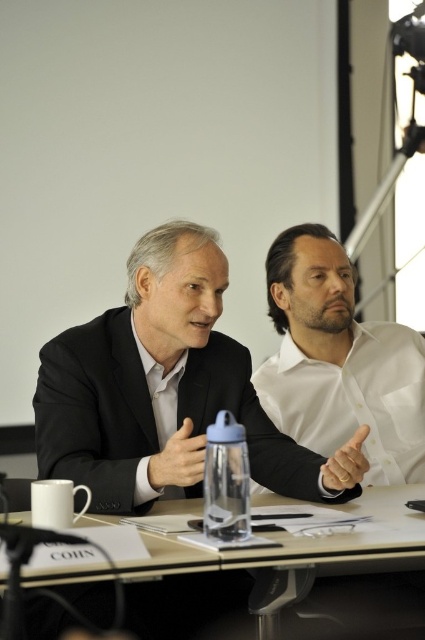
Is white glossy shirt at center to the left of clear glass water at center from the viewer's perspective?

Incorrect, white glossy shirt at center is not on the left side of clear glass water at center.

Consider the image. Who is positioned more to the right, white glossy shirt at center or clear glass water at center?

From the viewer's perspective, white glossy shirt at center appears more on the right side.

The image size is (425, 640). I want to click on white glossy shirt at center, so click(x=340, y=362).

The height and width of the screenshot is (640, 425). Identify the location of white glossy shirt at center. (340, 362).

You are a GUI agent. You are given a task and a screenshot of the screen. Output one action in this format:
    pyautogui.click(x=<x>, y=<y>)
    Task: Click on the black matte suit at center
    This screenshot has width=425, height=640.
    Given the screenshot: What is the action you would take?
    pyautogui.click(x=150, y=413)

Who is shorter, black matte suit at center or white glossy shirt at center?

black matte suit at center

Is point (184, 492) behind point (286, 264)?

No, (184, 492) is in front of (286, 264).

Where is `black matte suit at center`? black matte suit at center is located at coordinates (150, 413).

Which is in front, point (59, 365) or point (133, 612)?

Point (133, 612) is more forward.

In the scene shown: Can you confirm if black matte suit at center is positioned to the left of clear glass water at center?

Correct, you'll find black matte suit at center to the left of clear glass water at center.

Is point (42, 396) behind point (37, 612)?

Yes, point (42, 396) is behind point (37, 612).

The image size is (425, 640). I want to click on black matte suit at center, so click(150, 413).